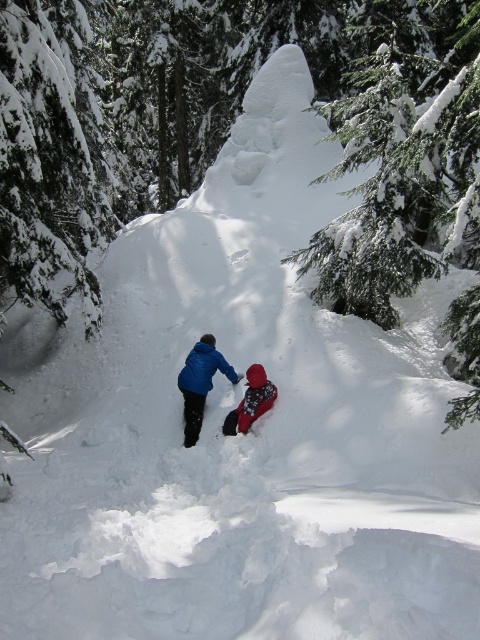
Question: Is blue fabric jacket at center wider than red fleece jacket at center?

Choices:
 (A) no
 (B) yes

Answer: (B)

Question: Among these points, which one is nearest to the camera?

Choices:
 (A) (187, 356)
 (B) (257, 406)

Answer: (B)

Question: Is blue fabric jacket at center wider than red fleece jacket at center?

Choices:
 (A) yes
 (B) no

Answer: (A)

Question: Can you confirm if blue fabric jacket at center is wider than red fleece jacket at center?

Choices:
 (A) no
 (B) yes

Answer: (B)

Question: Which object appears closest to the camera in this image?

Choices:
 (A) red fleece jacket at center
 (B) blue fabric jacket at center

Answer: (A)